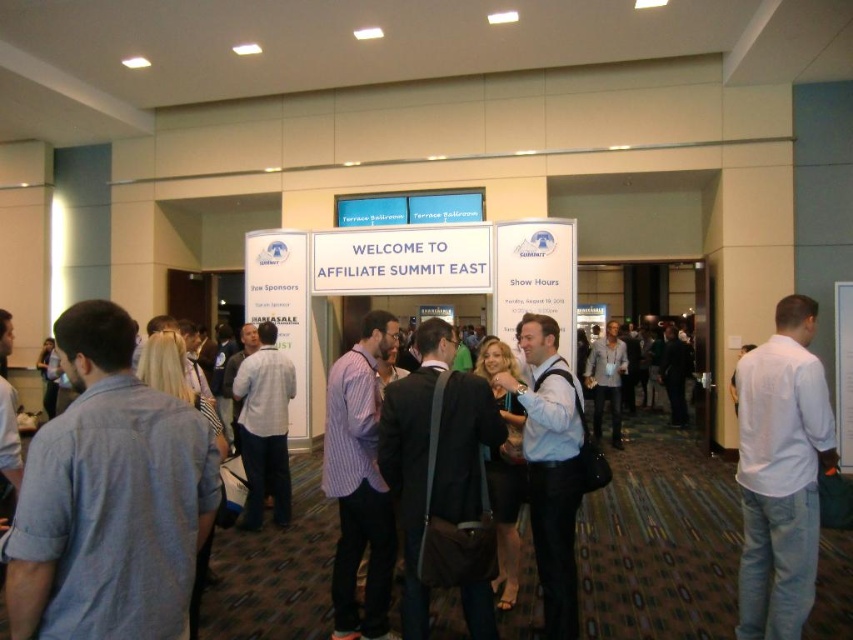
Question: Which object is farther from the camera taking this photo?

Choices:
 (A) light blue cotton shirt at left
 (B) white cotton shirt at right

Answer: (B)

Question: Among these objects, which one is farthest from the camera?

Choices:
 (A) white cotton shirt at right
 (B) light blue cotton shirt at left

Answer: (A)

Question: Can you confirm if light blue cotton shirt at left is positioned to the right of white cotton shirt at right?

Choices:
 (A) yes
 (B) no

Answer: (B)

Question: Is the position of light blue cotton shirt at left more distant than that of white cotton shirt at right?

Choices:
 (A) no
 (B) yes

Answer: (A)

Question: Is light blue cotton shirt at left to the right of white cotton shirt at right from the viewer's perspective?

Choices:
 (A) no
 (B) yes

Answer: (A)

Question: Among these objects, which one is farthest from the camera?

Choices:
 (A) light blue cotton shirt at left
 (B) white cotton shirt at right

Answer: (B)